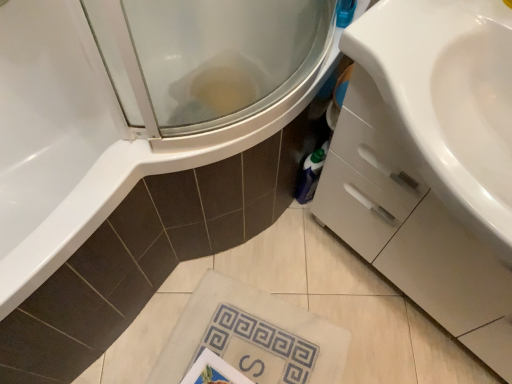
Identify the location of white textured towel at lower center. (252, 336).

The image size is (512, 384). Describe the element at coordinates (252, 336) in the screenshot. I see `white textured towel at lower center` at that location.

The height and width of the screenshot is (384, 512). In order to click on white glossy cabinet at right in this screenshot , I will do `click(425, 166)`.

What do you see at coordinates (425, 166) in the screenshot? I see `white glossy cabinet at right` at bounding box center [425, 166].

This screenshot has width=512, height=384. I want to click on white textured towel at lower center, so click(x=252, y=336).

Which is more to the left, white textured towel at lower center or white glossy cabinet at right?

Positioned to the left is white textured towel at lower center.

Is white textured towel at lower center in front of or behind white glossy cabinet at right in the image?

Visually, white textured towel at lower center is located behind white glossy cabinet at right.

Is point (295, 313) positioned after point (453, 171)?

Yes, it is.

From the image's perspective, which one is positioned lower, white textured towel at lower center or white glossy cabinet at right?

From the image's view, white textured towel at lower center is below.

From a real-world perspective, which object rests below the other?

white textured towel at lower center, from a real-world perspective.

In terms of width, does white textured towel at lower center look wider or thinner when compared to white glossy cabinet at right?

Clearly, white textured towel at lower center has more width compared to white glossy cabinet at right.

Is white textured towel at lower center taller or shorter than white glossy cabinet at right?

Considering their sizes, white textured towel at lower center has less height than white glossy cabinet at right.

Which of these two, white textured towel at lower center or white glossy cabinet at right, is smaller?

Smaller between the two is white textured towel at lower center.

Is white textured towel at lower center inside or outside of white glossy cabinet at right?

white textured towel at lower center is not enclosed by white glossy cabinet at right.

Is white textured towel at lower center next to white glossy cabinet at right and touching it?

No, white textured towel at lower center is not touching white glossy cabinet at right.

Could you tell me if white textured towel at lower center is facing white glossy cabinet at right?

No, white textured towel at lower center is not turned towards white glossy cabinet at right.

Measure the distance between white textured towel at lower center and white glossy cabinet at right.

19.95 inches.

Find the location of a particular element. This screenshot has height=384, width=512. beach towel below the white glossy cabinet at right (from a real-world perspective) is located at coordinates (252, 336).

Considering the positions of objects white glossy cabinet at right and white textured towel at lower center in the image provided, who is more to the left, white glossy cabinet at right or white textured towel at lower center?

white textured towel at lower center is more to the left.

Is white glossy cabinet at right further to the viewer compared to white textured towel at lower center?

No.

Does point (475, 221) lie behind point (304, 345)?

No, (475, 221) is in front of (304, 345).

From the image's perspective, is white glossy cabinet at right above white textured towel at lower center?

Indeed, from the image's perspective, white glossy cabinet at right is shown above white textured towel at lower center.

From a real-world perspective, is white glossy cabinet at right on top of white textured towel at lower center?

Yes, from a real-world perspective, white glossy cabinet at right is over white textured towel at lower center

Consider the image. In terms of width, does white glossy cabinet at right look wider or thinner when compared to white textured towel at lower center?

white glossy cabinet at right is thinner than white textured towel at lower center.

Who is shorter, white glossy cabinet at right or white textured towel at lower center?

With less height is white textured towel at lower center.

Considering the relative sizes of white glossy cabinet at right and white textured towel at lower center in the image provided, is white glossy cabinet at right smaller than white textured towel at lower center?

No, white glossy cabinet at right is not smaller than white textured towel at lower center.

Which is correct: white glossy cabinet at right is inside white textured towel at lower center, or outside of it?

white glossy cabinet at right is not enclosed by white textured towel at lower center.

From the picture: Is white glossy cabinet at right next to white textured towel at lower center?

No, white glossy cabinet at right is not next to white textured towel at lower center.

Is white glossy cabinet at right turned away from white textured towel at lower center?

That's not correct — white glossy cabinet at right is not looking away from white textured towel at lower center.

How different are the orientations of white glossy cabinet at right and white textured towel at lower center in degrees?

111 degrees.

At what (x,y) coordinates should I click in order to perform the action: click on bathroom cabinet on the right of white textured towel at lower center. Please return your answer as a coordinate pair (x, y). This screenshot has height=384, width=512. Looking at the image, I should click on (425, 166).

Identify the location of bathroom cabinet that appears above the white textured towel at lower center (from the image's perspective). The image size is (512, 384). (425, 166).

Identify the location of beach towel behind the white glossy cabinet at right. The image size is (512, 384). (252, 336).